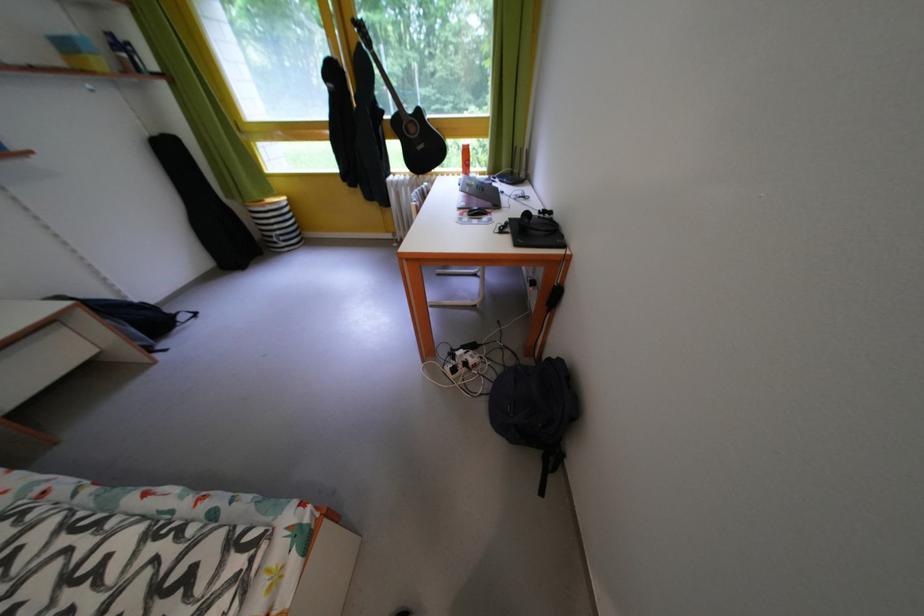
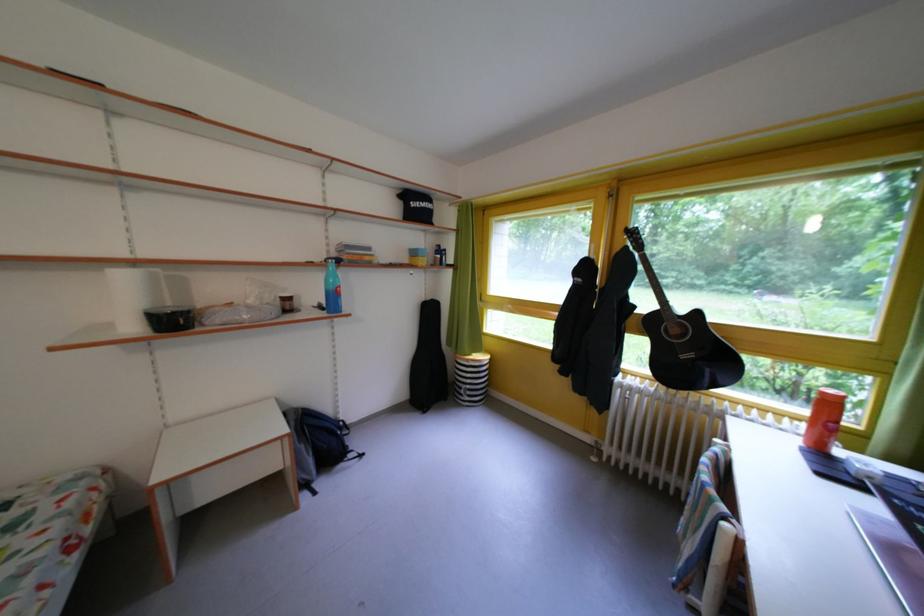
The point at (216,269) is marked in the first image. Where is the corresponding point in the second image?

(415, 400)